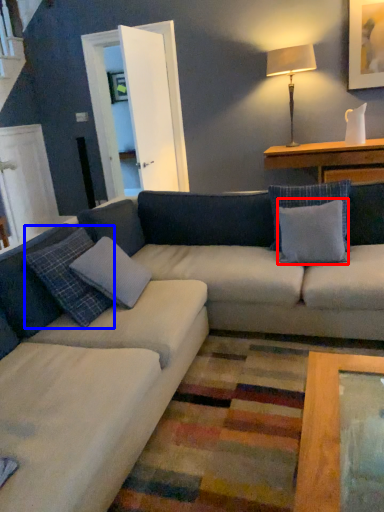
Question: Among these objects, which one is farthest to the camera, pillow (highlighted by a red box) or pillow (highlighted by a blue box)?

Choices:
 (A) pillow
 (B) pillow

Answer: (A)